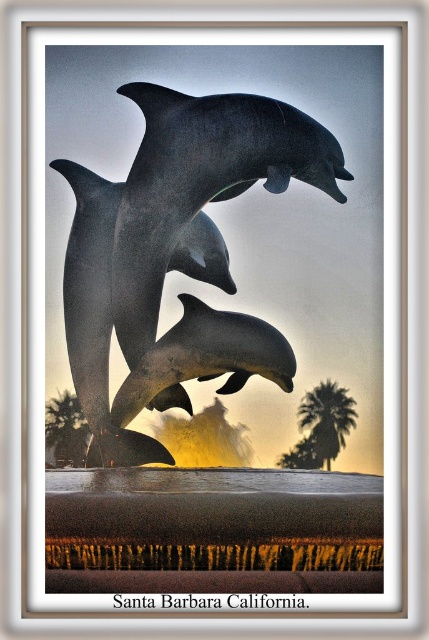
Locate an element on the screen. Image resolution: width=429 pixels, height=640 pixels. shiny metallic dolphins at center is located at coordinates coord(96,314).

Locate an element on the screen. shiny metallic dolphins at center is located at coordinates (96, 314).

Between point (111, 195) and point (329, 444), which one is positioned behind?

The point (329, 444) is behind.

Does shiny metallic dolphins at center have a lesser width compared to green leafy palm tree at center right?

In fact, shiny metallic dolphins at center might be wider than green leafy palm tree at center right.

Where is `shiny metallic dolphins at center`? The width and height of the screenshot is (429, 640). shiny metallic dolphins at center is located at coordinates (96, 314).

Does shiny metallic dolphins at center have a lesser width compared to shiny silver dolphin at center?

Incorrect, shiny metallic dolphins at center's width is not less than shiny silver dolphin at center's.

Describe the element at coordinates (96, 314) in the screenshot. Image resolution: width=429 pixels, height=640 pixels. I see `shiny metallic dolphins at center` at that location.

At what (x,y) coordinates should I click in order to perform the action: click on shiny metallic dolphins at center. Please return your answer as a coordinate pair (x, y). Image resolution: width=429 pixels, height=640 pixels. Looking at the image, I should click on (96, 314).

In order to click on shiny metallic dolphins at center in this screenshot , I will do `click(96, 314)`.